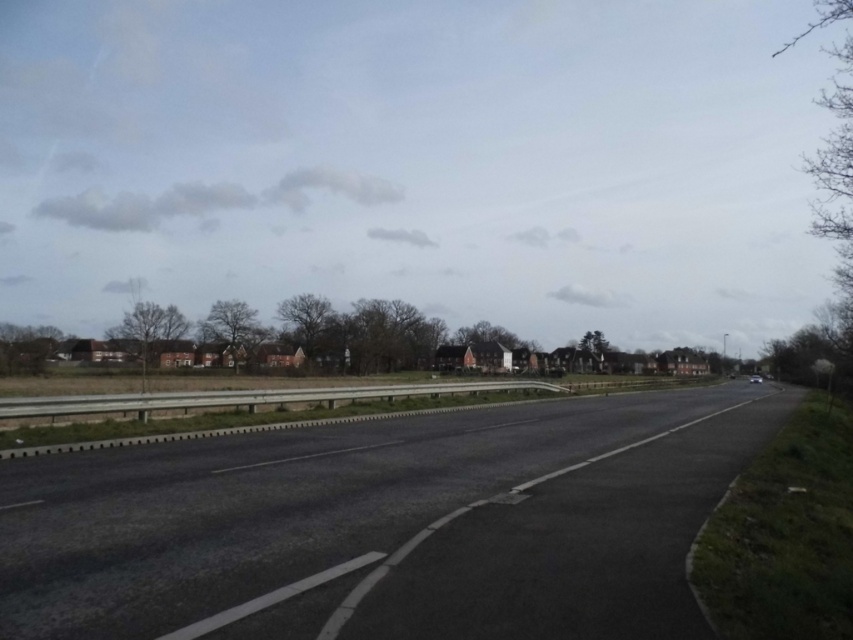
Question: Which point is closer to the camera?

Choices:
 (A) (561, 518)
 (B) (180, 401)

Answer: (A)

Question: Is asphalt road at center thinner than smooth concrete barrier at center?

Choices:
 (A) no
 (B) yes

Answer: (B)

Question: Which point appears farthest from the camera in this image?

Choices:
 (A) (114, 456)
 (B) (323, 401)

Answer: (B)

Question: Can you confirm if asphalt road at center is smaller than smooth concrete barrier at center?

Choices:
 (A) no
 (B) yes

Answer: (B)

Question: Is asphalt road at center positioned in front of smooth concrete barrier at center?

Choices:
 (A) yes
 (B) no

Answer: (A)